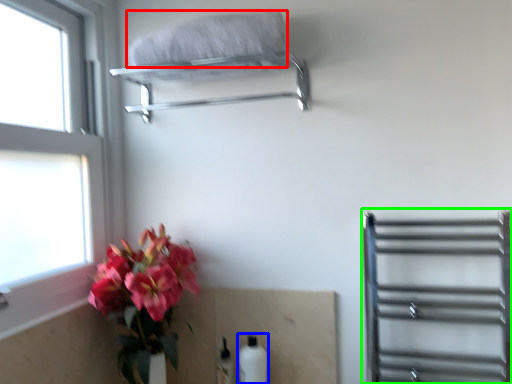
Question: Considering the real-world distances, which object is farthest from bath towel (highlighted by a red box)? bottle (highlighted by a blue box) or shelf (highlighted by a green box)?

Choices:
 (A) bottle
 (B) shelf

Answer: (A)